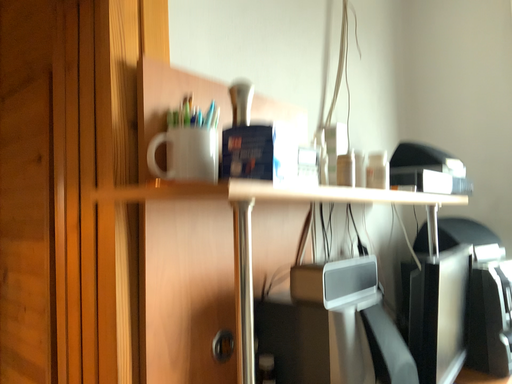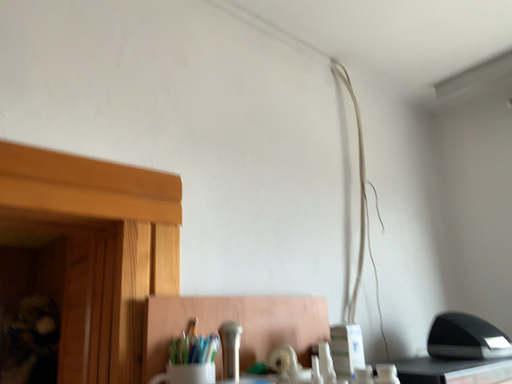
Question: Which way did the camera rotate in the video?

Choices:
 (A) rotated left
 (B) rotated right

Answer: (A)